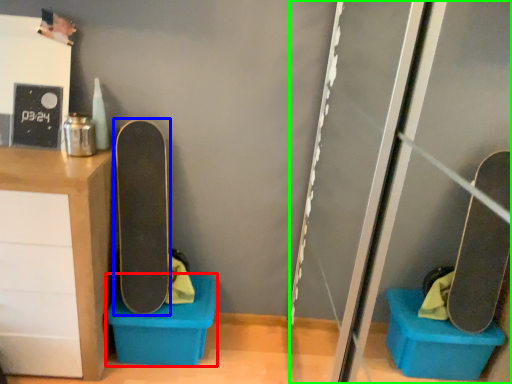
Question: Considering the real-world distances, which object is farthest from storage box (highlighted by a red box)? skateboard (highlighted by a blue box) or screen door (highlighted by a green box)?

Choices:
 (A) skateboard
 (B) screen door

Answer: (B)